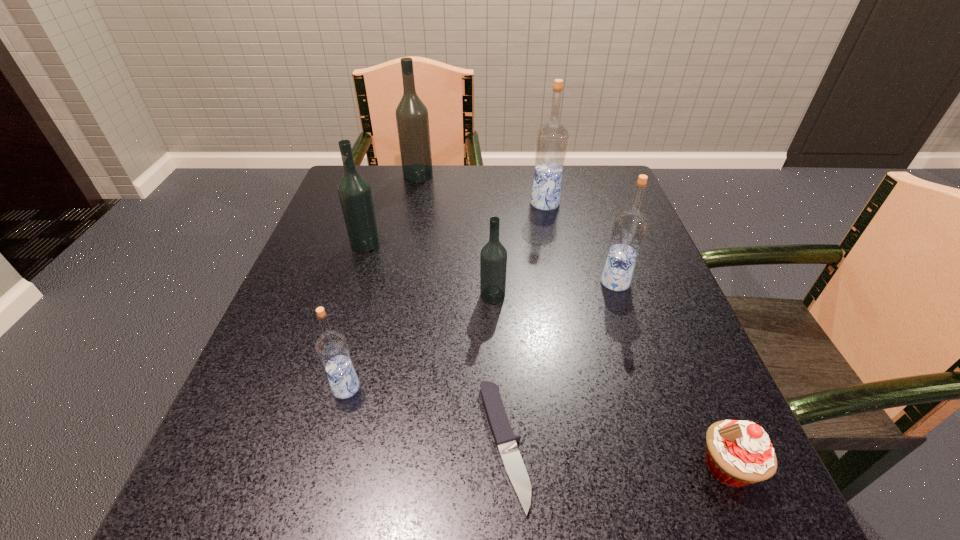
Identify the location of blue vodka that is the closest to the farthest vodka. This screenshot has height=540, width=960. (552, 138).

The image size is (960, 540). I want to click on blue vodka that is the second closest one to the second farthest black vodka, so click(x=552, y=138).

Where is `vacant position in the image that satisfies the following two spatial constraints: 1. on the back side of the second biggest blue vodka; 2. on the right side of the shortest object`? The width and height of the screenshot is (960, 540). vacant position in the image that satisfies the following two spatial constraints: 1. on the back side of the second biggest blue vodka; 2. on the right side of the shortest object is located at coordinates (496, 282).

Locate an element on the screen. This screenshot has width=960, height=540. vacant position in the image that satisfies the following two spatial constraints: 1. on the front side of the biggest black vodka; 2. on the left side of the pink cupcake is located at coordinates (357, 467).

The image size is (960, 540). Find the location of `free space that satisfies the following two spatial constraints: 1. on the front side of the second nearest blue vodka; 2. on the right side of the farthest blue vodka`. free space that satisfies the following two spatial constraints: 1. on the front side of the second nearest blue vodka; 2. on the right side of the farthest blue vodka is located at coordinates (561, 282).